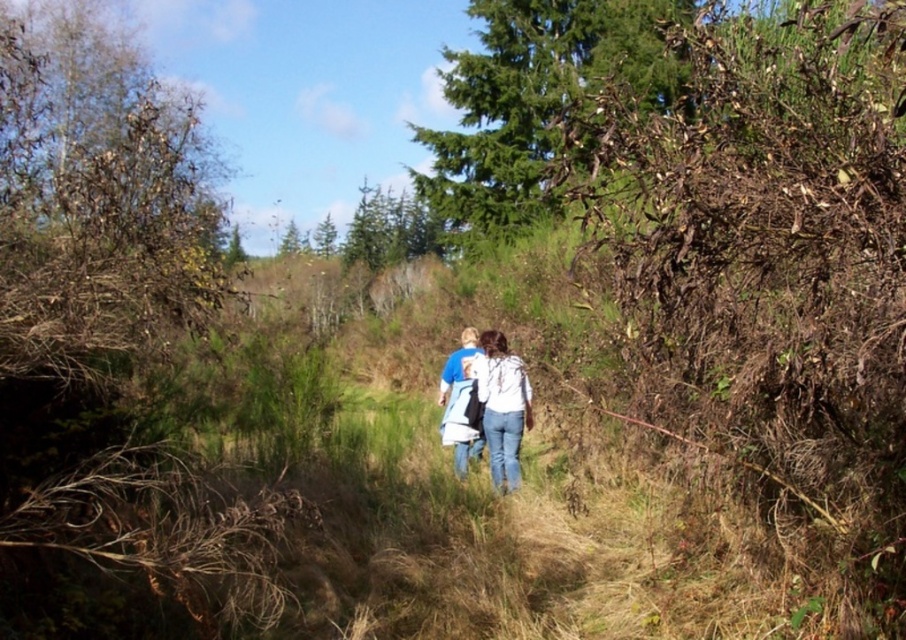
Question: Which of the following is the farthest from the observer?

Choices:
 (A) green textured tree at upper center
 (B) green leafy tree at upper center

Answer: (B)

Question: Does green textured tree at upper center come behind green leafy tree at upper center?

Choices:
 (A) no
 (B) yes

Answer: (A)

Question: Can you confirm if green textured tree at upper center is wider than white cotton shirt at center?

Choices:
 (A) no
 (B) yes

Answer: (B)

Question: Is green textured tree at upper center wider than white cotton shirt at center?

Choices:
 (A) no
 (B) yes

Answer: (B)

Question: Which point is farther to the camera?

Choices:
 (A) pyautogui.click(x=500, y=234)
 (B) pyautogui.click(x=479, y=365)

Answer: (A)

Question: Among these objects, which one is nearest to the camera?

Choices:
 (A) green leafy tree at upper center
 (B) white cotton shirt at center

Answer: (B)